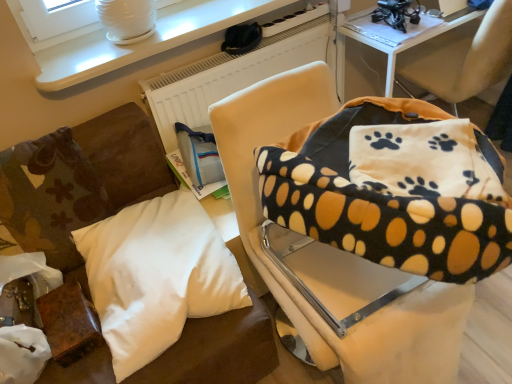
Question: Is white soft pillow at lower left, the third pillow positioned from the right, spatially inside white matte radiator at upper center, or outside of it?

Choices:
 (A) outside
 (B) inside

Answer: (A)

Question: In terms of height, does white soft pillow at lower left, the third pillow positioned from the right, look taller or shorter compared to white matte radiator at upper center?

Choices:
 (A) tall
 (B) short

Answer: (B)

Question: Based on their relative distances, which object is nearer to the soft fleece blanket at upper right, which is the second chair from left to right?

Choices:
 (A) white fleece pillow at upper right, which ranks as the 1th pillow in right-to-left order
 (B) white matte radiator at upper center
 (C) white soft pillow at lower left, the third pillow positioned from the right
 (D) white soft pillow at lower left, the second pillow in the left-to-right sequence
 (E) white glossy table at upper left

Answer: (B)

Question: Considering the real-world distances, which object is farthest from the white glossy table at upper left?

Choices:
 (A) white fleece pillow at upper right, which is counted as the 3th pillow, starting from the left
 (B) white soft pillow at lower left, the 1th pillow when ordered from left to right
 (C) white soft pillow at lower left, acting as the 2th pillow starting from the right
 (D) soft fleece blanket at upper right, which is the second chair from left to right
 (E) soft beige chair at center, placed as the 2th chair when sorted from right to left

Answer: (A)